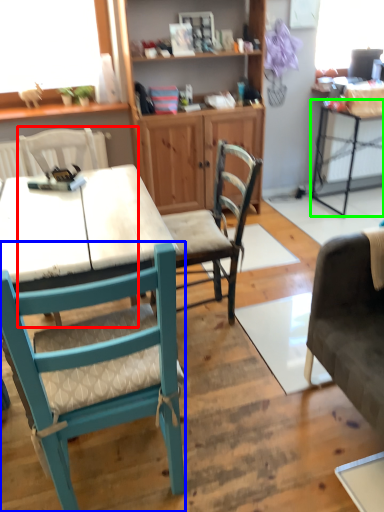
Question: Based on their relative distances, which object is farther from chair (highlighted by a red box)? Choose from chair (highlighted by a blue box) and table (highlighted by a green box).

Choices:
 (A) chair
 (B) table

Answer: (B)